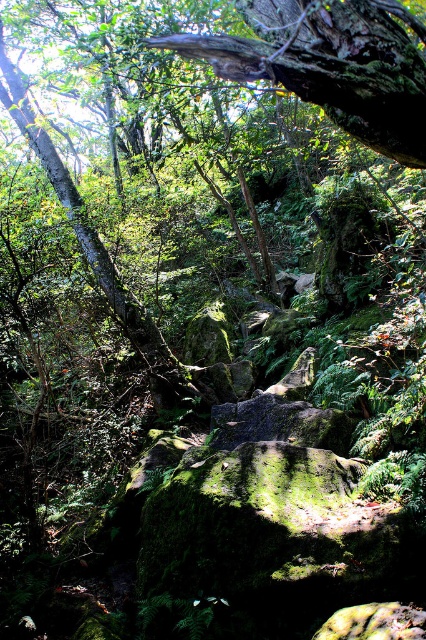
Question: Which point is closer to the camera?

Choices:
 (A) pos(342,17)
 (B) pos(40,154)

Answer: (A)

Question: Observing the image, what is the correct spatial positioning of green mossy tree trunk at upper center in reference to green mossy tree trunk at upper left?

Choices:
 (A) below
 (B) above

Answer: (A)

Question: Is green mossy tree trunk at upper center below green mossy tree trunk at upper left?

Choices:
 (A) yes
 (B) no

Answer: (A)

Question: Observing the image, what is the correct spatial positioning of green mossy tree trunk at upper center in reference to green mossy tree trunk at upper left?

Choices:
 (A) right
 (B) left

Answer: (A)

Question: Which point is farther to the camera?

Choices:
 (A) (365, 56)
 (B) (164, 356)

Answer: (B)